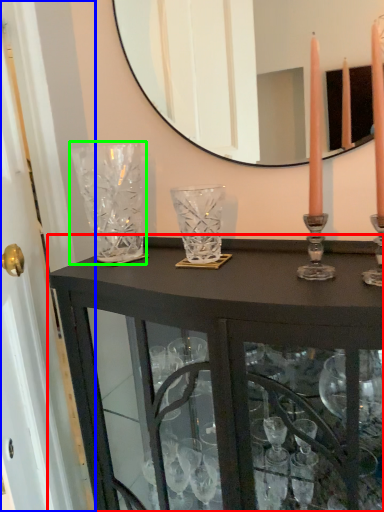
Question: Considering the real-world distances, which object is closest to table (highlighted by a red box)? glass door (highlighted by a blue box) or glass vase (highlighted by a green box).

Choices:
 (A) glass door
 (B) glass vase

Answer: (B)